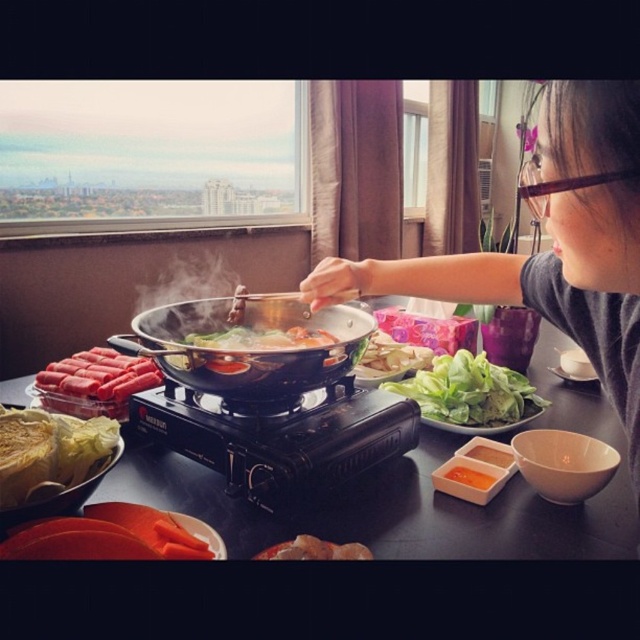
You are a guest at the dining table and want to reach for the brown crispy meat at lower center and the translucent orange liquid at center. Which one is easier to grab without moving your chair?

The brown crispy meat at lower center is closer to you, so it is easier to grab without moving your chair.

You are a chef preparing a stir fry and need to know which ingredient is taller between the green leafy vegetable at lower left and the translucent orange liquid at center. Which one is taller?

The green leafy vegetable at lower left is much taller than the translucent orange liquid at center.

You are a chef preparing a stir fry and need to quickly grab the green leafy lettuce at center and white matte tofu at center. Which one is closer to you?

The green leafy lettuce at center is closer to you because it is in front of the white matte tofu at center.